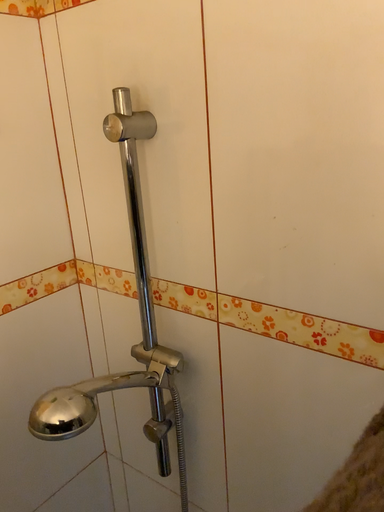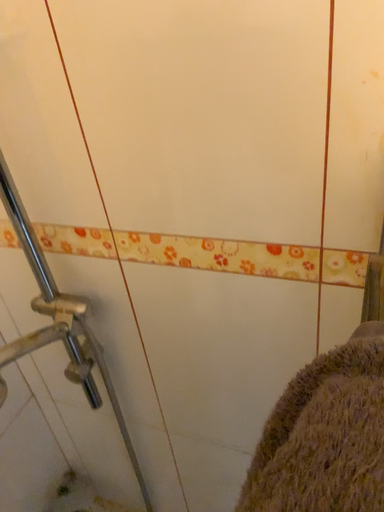
Question: How did the camera likely rotate when shooting the video?

Choices:
 (A) rotated left
 (B) rotated right

Answer: (B)